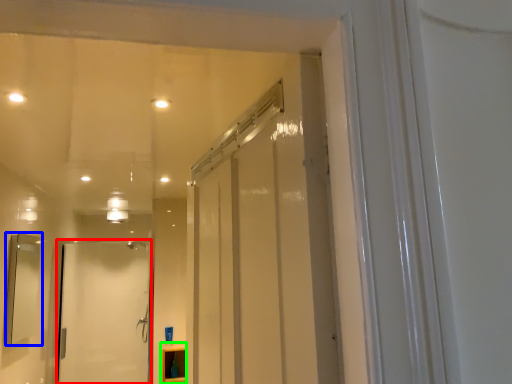
Question: Which is nearer to the door (highlighted by a red box)? mirror (highlighted by a blue box) or cabinetry (highlighted by a green box).

Choices:
 (A) mirror
 (B) cabinetry

Answer: (B)